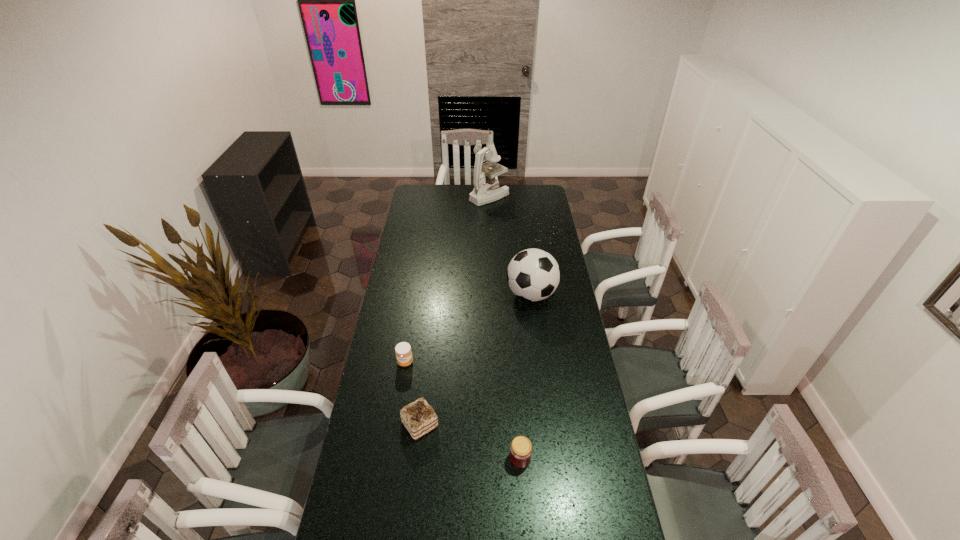
I want to click on the tallest object, so click(x=486, y=189).

In order to click on microscope in this screenshot , I will do `click(486, 189)`.

Where is `the fourth shortest object`? This screenshot has height=540, width=960. the fourth shortest object is located at coordinates [533, 274].

You are a GUI agent. You are given a task and a screenshot of the screen. Output one action in this format:
    pyautogui.click(x=<x>, y=<y>)
    Task: Click on the soccer ball
    This screenshot has width=960, height=540.
    Given the screenshot: What is the action you would take?
    pyautogui.click(x=533, y=274)

Find the location of a particular element. The width and height of the screenshot is (960, 540). the left jam is located at coordinates (403, 351).

This screenshot has width=960, height=540. I want to click on the farther jam, so pyautogui.click(x=403, y=351).

Locate an element on the screen. the second nearest object is located at coordinates (419, 418).

At what (x,y) coordinates should I click in order to perform the action: click on the nearer jam. Please return your answer as a coordinate pair (x, y). The width and height of the screenshot is (960, 540). Looking at the image, I should click on (520, 454).

You are a GUI agent. You are given a task and a screenshot of the screen. Output one action in this format:
    pyautogui.click(x=<x>, y=<y>)
    Task: Click on the right jam
    The width and height of the screenshot is (960, 540).
    Given the screenshot: What is the action you would take?
    pyautogui.click(x=520, y=454)

Identify the location of vacant space located 0.240m on the right of the farthest object. Image resolution: width=960 pixels, height=540 pixels. (548, 196).